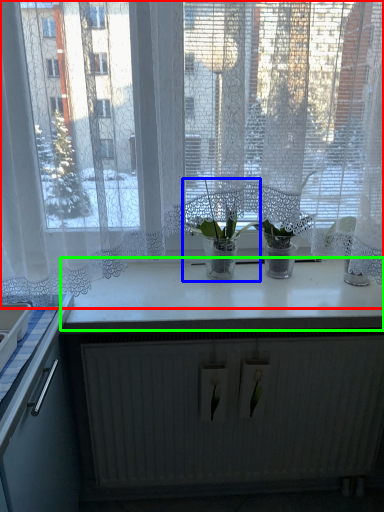
Question: Based on their relative distances, which object is nearer to window (highlighted by a red box)? Choose from houseplant (highlighted by a blue box) and counter top (highlighted by a green box).

Choices:
 (A) houseplant
 (B) counter top

Answer: (A)